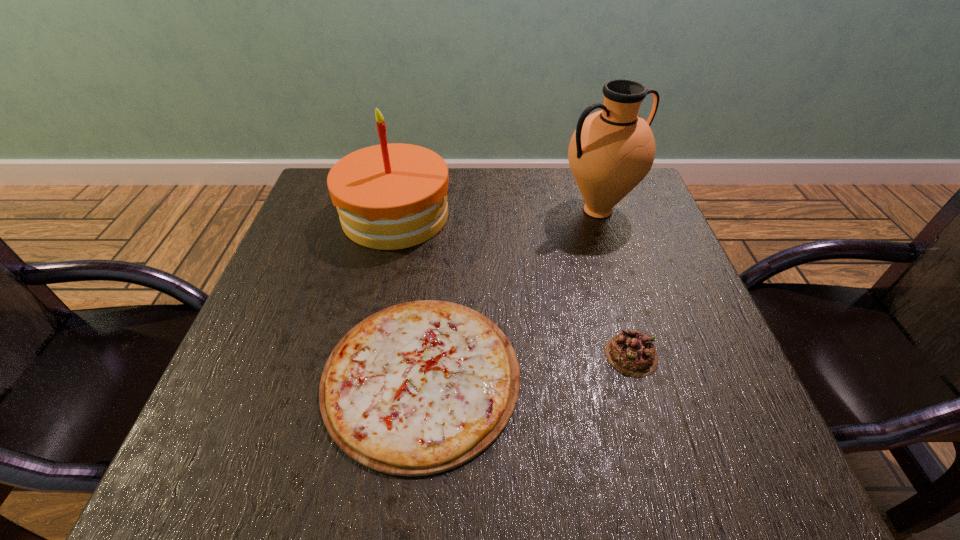
Where is `pitcher`? The width and height of the screenshot is (960, 540). pitcher is located at coordinates (611, 151).

Identify the location of birthday cake. This screenshot has height=540, width=960. (393, 196).

This screenshot has height=540, width=960. Identify the location of chocolate cake. (630, 352).

You are a GUI agent. You are given a task and a screenshot of the screen. Output one action in this format:
    pyautogui.click(x=<x>, y=<y>)
    Task: Click on the pizza
    The width and height of the screenshot is (960, 540).
    Given the screenshot: What is the action you would take?
    pyautogui.click(x=418, y=388)

What are the coordinates of `vacant region located 0.300m on the left of the pitcher` in the screenshot? It's located at (441, 211).

Where is `free location located on the back of the birthday cake`? free location located on the back of the birthday cake is located at coordinates (405, 173).

This screenshot has width=960, height=540. Identify the location of free region located 0.320m on the back of the chocolate cake. (594, 229).

You are a GUI agent. You are given a task and a screenshot of the screen. Output one action in this format:
    pyautogui.click(x=<x>, y=<y>)
    Task: Click on the vacant space situated 0.360m on the right of the shortest object
    This screenshot has height=540, width=960.
    Given the screenshot: What is the action you would take?
    pyautogui.click(x=724, y=376)

At what (x,y) coordinates should I click in order to perform the action: click on pitcher that is at the far edge. Please return your answer as a coordinate pair (x, y). The width and height of the screenshot is (960, 540). Looking at the image, I should click on (611, 151).

Find the location of a particular element. Image resolution: width=960 pixels, height=540 pixels. birthday cake situated at the far edge is located at coordinates (393, 196).